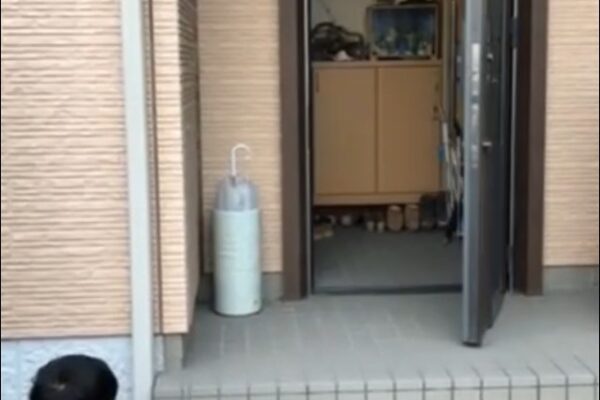
Image resolution: width=600 pixels, height=400 pixels. In order to click on door handle in this screenshot , I will do `click(494, 154)`.